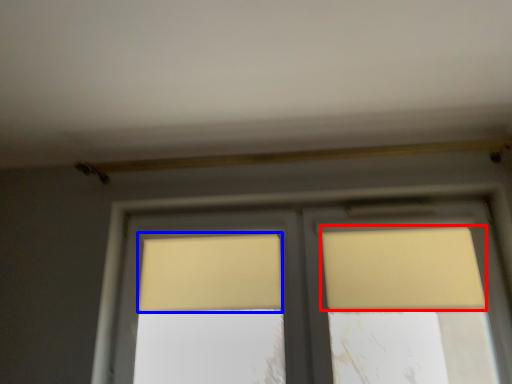
Question: Among these objects, which one is nearest to the camera, curtain (highlighted by a red box) or curtain (highlighted by a blue box)?

Choices:
 (A) curtain
 (B) curtain

Answer: (A)